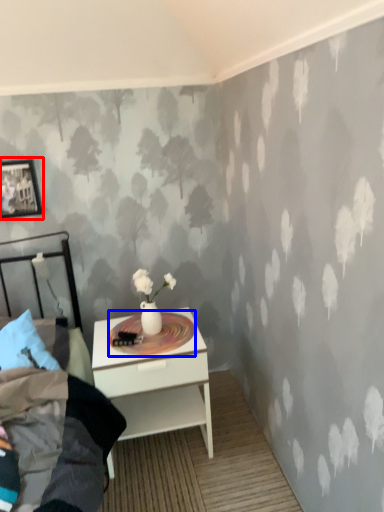
Question: Which object is further to the camera taking this photo, picture frame (highlighted by a red box) or round table (highlighted by a blue box)?

Choices:
 (A) picture frame
 (B) round table

Answer: (A)